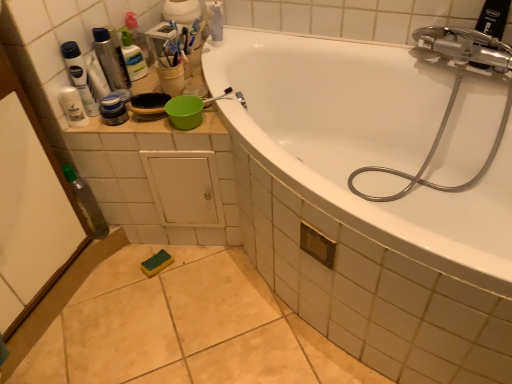
What do you see at coordinates (113, 110) in the screenshot? Image resolution: width=512 pixels, height=384 pixels. I see `matte black jar at upper left, which is the first toiletry in bottom-to-top order` at bounding box center [113, 110].

You are a GUI agent. You are given a task and a screenshot of the screen. Output one action in this format:
    pyautogui.click(x=<x>, y=<y>)
    Task: Click on the matte black jar at upper left, acting as the 3th toiletry starting from the top
    This screenshot has height=384, width=512.
    Given the screenshot: What is the action you would take?
    pyautogui.click(x=113, y=110)

Locate an element on the screen. The height and width of the screenshot is (384, 512). translucent plastic container at upper left, the 3th toiletry ordered from the bottom is located at coordinates (x=133, y=56).

Where is `transparent plastic screen door at left`? transparent plastic screen door at left is located at coordinates (30, 215).

Measure the distance between point [11,139] and camera.

1.00 meters.

At what (x,y) coordinates should I click in order to perform the action: click on white glossy bathtub at upper center. Please return your answer as a coordinate pair (x, y). Image resolution: width=512 pixels, height=384 pixels. Looking at the image, I should click on (365, 142).

Is white glossy bathtub at upper center next to translucent plastic container at upper left, which ranks as the 1th toiletry in top-to-bottom order, and touching it?

No, white glossy bathtub at upper center is not making contact with translucent plastic container at upper left, which ranks as the 1th toiletry in top-to-bottom order.

Does white glossy bathtub at upper center appear on the left side of translucent plastic container at upper left, which ranks as the 1th toiletry in top-to-bottom order?

No.

Looking at the image, does white glossy bathtub at upper center seem bigger or smaller compared to translucent plastic container at upper left, the 3th toiletry ordered from the bottom?

Clearly, white glossy bathtub at upper center is larger in size than translucent plastic container at upper left, the 3th toiletry ordered from the bottom.

Which of these two, white glossy bathtub at upper center or translucent plastic container at upper left, which ranks as the 1th toiletry in top-to-bottom order, is wider?

With larger width is white glossy bathtub at upper center.

From a real-world perspective, does matte black jar at upper left, acting as the 3th toiletry starting from the top, sit lower than transparent plastic screen door at left?

No.

Is matte black jar at upper left, which is the first toiletry in bottom-to-top order, in front of transparent plastic screen door at left?

No, the depth of matte black jar at upper left, which is the first toiletry in bottom-to-top order, is greater than that of transparent plastic screen door at left.

Find the location of `toiletry that is the 1st one below the metallic silver canister at upper left, which is counted as the second toiletry, starting from the top (from a real-world perspective)`. toiletry that is the 1st one below the metallic silver canister at upper left, which is counted as the second toiletry, starting from the top (from a real-world perspective) is located at coordinates (133, 56).

Is metallic silver canister at upper left, placed as the 2th toiletry when sorted from bottom to top, surrounding translucent plastic container at upper left, the 3th toiletry ordered from the bottom?

Actually, translucent plastic container at upper left, the 3th toiletry ordered from the bottom, is outside metallic silver canister at upper left, placed as the 2th toiletry when sorted from bottom to top.

Is metallic silver canister at upper left, which is counted as the second toiletry, starting from the top, not near translucent plastic container at upper left, which ranks as the 1th toiletry in top-to-bottom order?

Actually, metallic silver canister at upper left, which is counted as the second toiletry, starting from the top, and translucent plastic container at upper left, which ranks as the 1th toiletry in top-to-bottom order, are a little close together.

Is transparent plastic screen door at left touching metallic silver canister at upper left, placed as the 2th toiletry when sorted from bottom to top?

transparent plastic screen door at left and metallic silver canister at upper left, placed as the 2th toiletry when sorted from bottom to top, are not in contact.

From a real-world perspective, is transparent plastic screen door at left under metallic silver canister at upper left, which is counted as the second toiletry, starting from the top?

Yes, from a real-world perspective, transparent plastic screen door at left is under metallic silver canister at upper left, which is counted as the second toiletry, starting from the top.

At what (x,y) coordinates should I click in order to perform the action: click on the 2nd toiletry behind the transparent plastic screen door at left. Please return your answer as a coordinate pair (x, y). Looking at the image, I should click on (110, 60).

Can we say transparent plastic screen door at left lies outside metallic silver canister at upper left, which is counted as the second toiletry, starting from the top?

Yes.

From a real-world perspective, is transparent plastic bottle at left physically above metallic silver canister at upper left, placed as the 2th toiletry when sorted from bottom to top?

No, from a real-world perspective, transparent plastic bottle at left is not over metallic silver canister at upper left, placed as the 2th toiletry when sorted from bottom to top

Could you tell me if transparent plastic bottle at left is facing metallic silver canister at upper left, placed as the 2th toiletry when sorted from bottom to top?

No.

Is transparent plastic bottle at left far away from metallic silver canister at upper left, placed as the 2th toiletry when sorted from bottom to top?

transparent plastic bottle at left is actually quite close to metallic silver canister at upper left, placed as the 2th toiletry when sorted from bottom to top.

Is transparent plastic bottle at left further to the viewer compared to metallic silver canister at upper left, which is counted as the second toiletry, starting from the top?

Yes, transparent plastic bottle at left is further from the camera.

Is metallic silver canister at upper left, placed as the 2th toiletry when sorted from bottom to top, turned away from matte black jar at upper left, acting as the 3th toiletry starting from the top?

No.

Can you confirm if metallic silver canister at upper left, which is counted as the second toiletry, starting from the top, is taller than matte black jar at upper left, which is the first toiletry in bottom-to-top order?

Yes, metallic silver canister at upper left, which is counted as the second toiletry, starting from the top, is taller than matte black jar at upper left, which is the first toiletry in bottom-to-top order.

From the image's perspective, which is below, metallic silver canister at upper left, which is counted as the second toiletry, starting from the top, or matte black jar at upper left, which is the first toiletry in bottom-to-top order?

matte black jar at upper left, which is the first toiletry in bottom-to-top order, is shown below in the image.

Based on their positions, is metallic silver canister at upper left, placed as the 2th toiletry when sorted from bottom to top, located to the left or right of matte black jar at upper left, which is the first toiletry in bottom-to-top order?

metallic silver canister at upper left, placed as the 2th toiletry when sorted from bottom to top, is to the left of matte black jar at upper left, which is the first toiletry in bottom-to-top order.

Is metallic silver canister at upper left, placed as the 2th toiletry when sorted from bottom to top, facing away from transparent plastic screen door at left?

metallic silver canister at upper left, placed as the 2th toiletry when sorted from bottom to top, does not have its back to transparent plastic screen door at left.

Are metallic silver canister at upper left, placed as the 2th toiletry when sorted from bottom to top, and transparent plastic screen door at left making contact?

No, metallic silver canister at upper left, placed as the 2th toiletry when sorted from bottom to top, is not making contact with transparent plastic screen door at left.

In the scene shown: Can we say metallic silver canister at upper left, placed as the 2th toiletry when sorted from bottom to top, lies outside transparent plastic screen door at left?

Answer: Yes.

Can you confirm if metallic silver canister at upper left, placed as the 2th toiletry when sorted from bottom to top, is thinner than transparent plastic screen door at left?

Yes, metallic silver canister at upper left, placed as the 2th toiletry when sorted from bottom to top, is thinner than transparent plastic screen door at left.

Where is `bathtub on the right of translucent plastic container at upper left, the 3th toiletry ordered from the bottom`? This screenshot has height=384, width=512. bathtub on the right of translucent plastic container at upper left, the 3th toiletry ordered from the bottom is located at coordinates (365, 142).

From the transparent plastic screen door at left, count 1st toiletrys backward and point to it. Please provide its 2D coordinates.

[(113, 110)]

Estimate the real-world distances between objects in this image. Which object is closer to translucent plastic container at upper left, which ranks as the 1th toiletry in top-to-bottom order, metallic silver canister at upper left, placed as the 2th toiletry when sorted from bottom to top, or transparent plastic bottle at left?

metallic silver canister at upper left, placed as the 2th toiletry when sorted from bottom to top.

Looking at this image, looking at the image, which one is located closer to white glossy mouthwash at upper left, silver metallic hose at upper right or matte black jar at upper left, which is the first toiletry in bottom-to-top order?

matte black jar at upper left, which is the first toiletry in bottom-to-top order, is positioned closer to the anchor white glossy mouthwash at upper left.

Looking at the image, which one is located closer to matte black jar at upper left, which is the first toiletry in bottom-to-top order, transparent plastic screen door at left or metallic silver canister at upper left, placed as the 2th toiletry when sorted from bottom to top?

metallic silver canister at upper left, placed as the 2th toiletry when sorted from bottom to top, is positioned closer to the anchor matte black jar at upper left, which is the first toiletry in bottom-to-top order.

Which object lies nearer to the anchor point translucent plastic container at upper left, which ranks as the 1th toiletry in top-to-bottom order, transparent plastic bottle at left or metallic silver canister at upper left, placed as the 2th toiletry when sorted from bottom to top?

Based on the image, metallic silver canister at upper left, placed as the 2th toiletry when sorted from bottom to top, appears to be nearer to translucent plastic container at upper left, which ranks as the 1th toiletry in top-to-bottom order.

Which object lies nearer to the anchor point silver metallic hose at upper right, transparent plastic bottle at left or translucent plastic container at upper left, the 3th toiletry ordered from the bottom?

The object closer to silver metallic hose at upper right is translucent plastic container at upper left, the 3th toiletry ordered from the bottom.

Based on the photo, when comparing their distances from transparent plastic bottle at left, does white glossy mouthwash at upper left or silver metallic hose at upper right seem further?

Among the two, silver metallic hose at upper right is located further to transparent plastic bottle at left.

Consider the image. Estimate the real-world distances between objects in this image. Which object is further from white glossy bathtub at upper center, translucent plastic container at upper left, which ranks as the 1th toiletry in top-to-bottom order, or silver metallic hose at upper right?

Based on the image, translucent plastic container at upper left, which ranks as the 1th toiletry in top-to-bottom order, appears to be further to white glossy bathtub at upper center.

When comparing their distances from matte black jar at upper left, acting as the 3th toiletry starting from the top, does translucent plastic container at upper left, which ranks as the 1th toiletry in top-to-bottom order, or white glossy mouthwash at upper left seem closer?

white glossy mouthwash at upper left.

The height and width of the screenshot is (384, 512). What are the coordinates of `bottle between transparent plastic screen door at left and white glossy bathtub at upper center from left to right` in the screenshot? It's located at (87, 203).

Find the location of `bottle between transparent plastic screen door at left and silver metallic hose at upper right from left to right`. bottle between transparent plastic screen door at left and silver metallic hose at upper right from left to right is located at coordinates (87, 203).

The image size is (512, 384). In order to click on mouthwash between transparent plastic bottle at left and white glossy bathtub at upper center from left to right in this screenshot , I will do `click(73, 107)`.

Image resolution: width=512 pixels, height=384 pixels. I want to click on mouthwash between translucent plastic container at upper left, the 3th toiletry ordered from the bottom, and matte black jar at upper left, which is the first toiletry in bottom-to-top order, vertically, so click(73, 107).